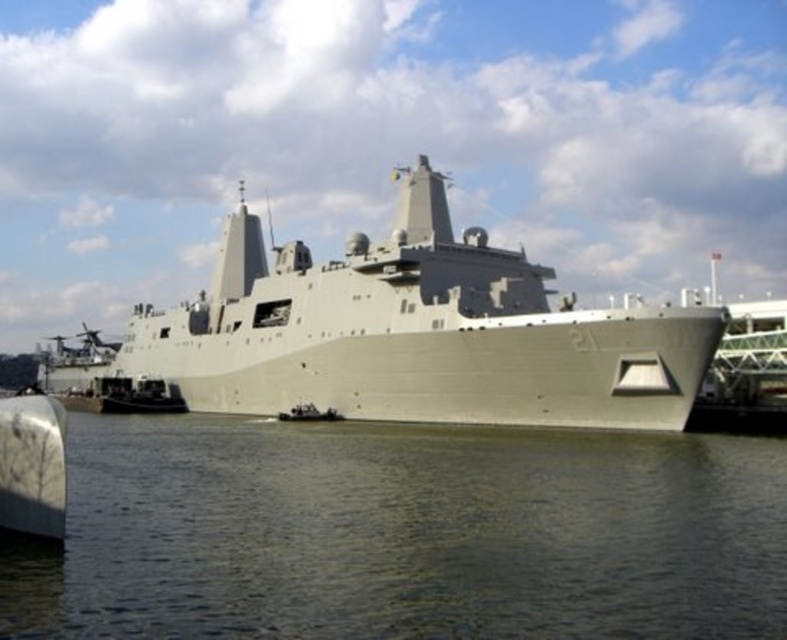
Question: Which object appears closest to the camera in this image?

Choices:
 (A) greenish water at lower center
 (B) gray matte ship at center

Answer: (A)

Question: In this image, where is greenish water at lower center located relative to gray matte ship at center?

Choices:
 (A) left
 (B) right

Answer: (B)

Question: Can you confirm if greenish water at lower center is positioned to the left of gray matte ship at center?

Choices:
 (A) yes
 (B) no

Answer: (B)

Question: From the image, what is the correct spatial relationship of greenish water at lower center in relation to gray matte ship at center?

Choices:
 (A) below
 (B) above

Answer: (A)